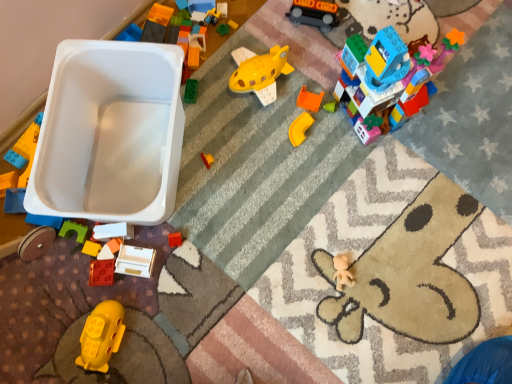
I want to click on empty space that is in between white plastic toy car at upper left and multicolored plastic building block at upper right, the first toy when ordered from right to left, so click(x=263, y=147).